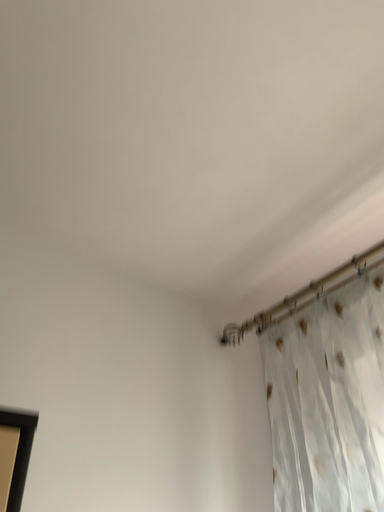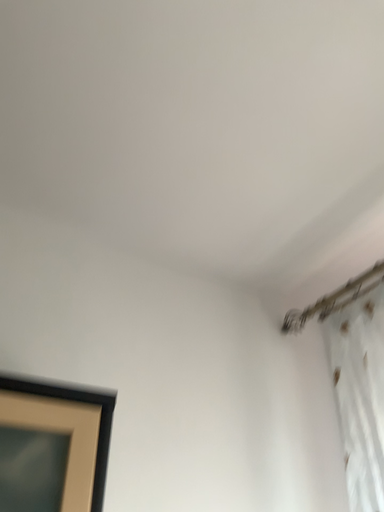
Question: How did the camera likely rotate when shooting the video?

Choices:
 (A) rotated right
 (B) rotated left

Answer: (B)